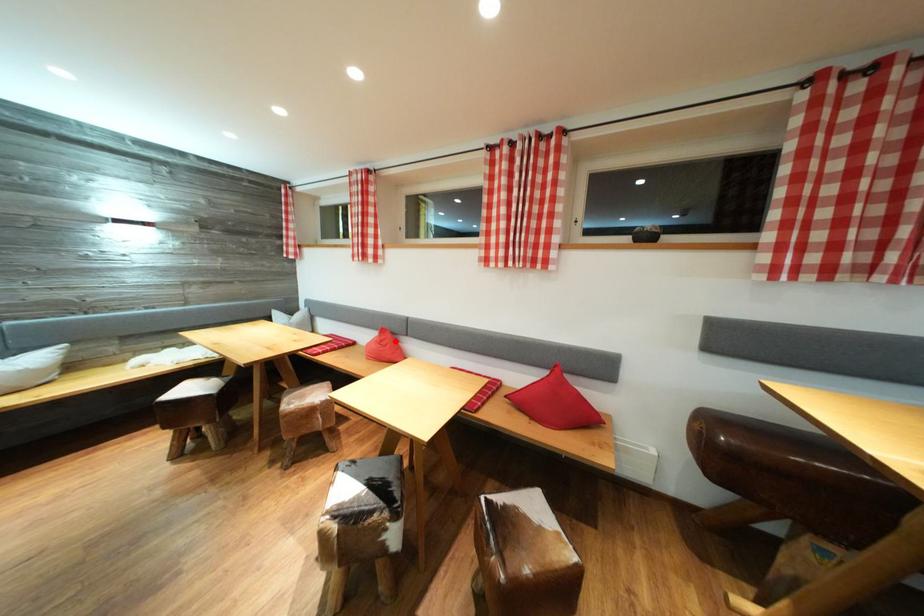
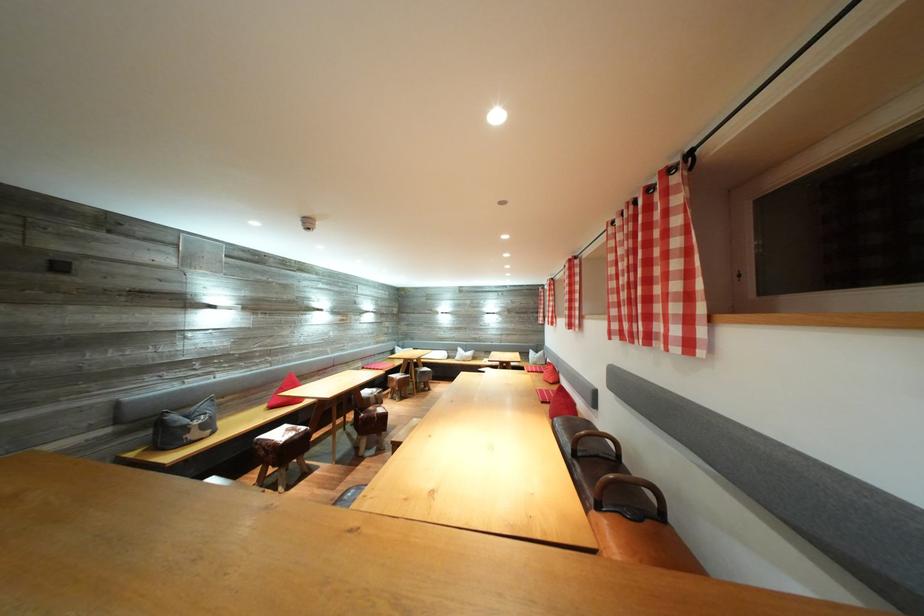
Locate, in the second image, the point that corresponds to the highlighted location in the first image.

(557, 373)